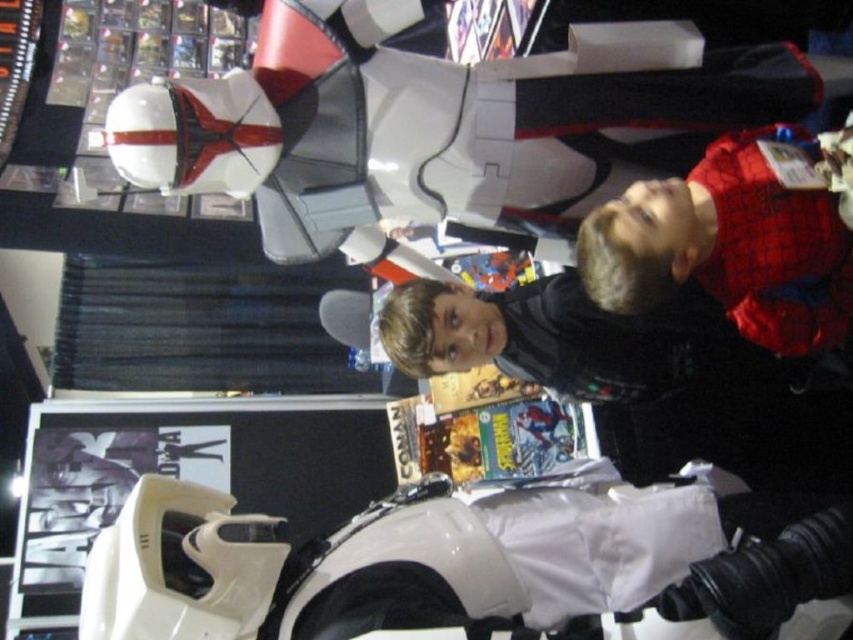
You are a photographer at the event and need to capture a photo that includes both the white glossy helmet at upper left and the matte white astronaut at upper right. The camera you are using has a maximum focus range of 40 centimeters. Will you be able to fit both subjects within the camera frame?

The white glossy helmet at upper left is 43.39 centimeters from the matte white astronaut at upper right. Since the distance between them exceeds the camera maximum focus range of 40 centimeters, you will not be able to fit both subjects within the camera frame.